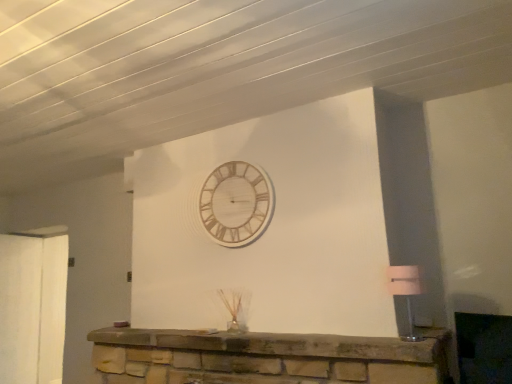
Question: Does stone fireplace at center have a larger size compared to wooden/textured wall clock at upper center?

Choices:
 (A) yes
 (B) no

Answer: (A)

Question: Does stone fireplace at center have a lesser height compared to wooden/textured wall clock at upper center?

Choices:
 (A) no
 (B) yes

Answer: (B)

Question: Can you confirm if stone fireplace at center is thinner than wooden/textured wall clock at upper center?

Choices:
 (A) no
 (B) yes

Answer: (A)

Question: Is stone fireplace at center outside of wooden/textured wall clock at upper center?

Choices:
 (A) no
 (B) yes

Answer: (B)

Question: Is stone fireplace at center smaller than wooden/textured wall clock at upper center?

Choices:
 (A) no
 (B) yes

Answer: (A)

Question: Relative to matte white lampshade at right, is wooden/textured wall clock at upper center in front or behind?

Choices:
 (A) behind
 (B) front

Answer: (A)

Question: From the image's perspective, is wooden/textured wall clock at upper center located above or below matte white lampshade at right?

Choices:
 (A) below
 (B) above

Answer: (B)

Question: Is wooden/textured wall clock at upper center taller or shorter than matte white lampshade at right?

Choices:
 (A) short
 (B) tall

Answer: (B)

Question: Visually, is wooden/textured wall clock at upper center positioned to the left or to the right of matte white lampshade at right?

Choices:
 (A) right
 (B) left

Answer: (B)

Question: From a real-world perspective, is matte white lampshade at right above or below wooden/textured wall clock at upper center?

Choices:
 (A) below
 (B) above

Answer: (A)

Question: From the image's perspective, relative to wooden/textured wall clock at upper center, is matte white lampshade at right above or below?

Choices:
 (A) above
 (B) below

Answer: (B)

Question: Considering the positions of point (399, 274) and point (227, 233), is point (399, 274) closer or farther from the camera than point (227, 233)?

Choices:
 (A) farther
 (B) closer

Answer: (B)

Question: In terms of height, does matte white lampshade at right look taller or shorter compared to wooden/textured wall clock at upper center?

Choices:
 (A) tall
 (B) short

Answer: (B)

Question: From the image's perspective, is matte white lampshade at right above or below stone fireplace at center?

Choices:
 (A) above
 (B) below

Answer: (A)

Question: Is matte white lampshade at right taller or shorter than stone fireplace at center?

Choices:
 (A) tall
 (B) short

Answer: (A)